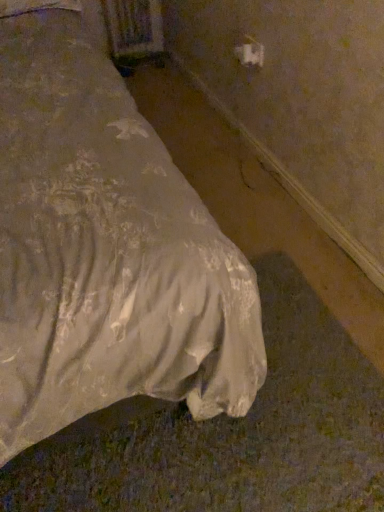
Question: Is white fabric bed at lower left wider than white plastic outlet at upper right?

Choices:
 (A) yes
 (B) no

Answer: (A)

Question: Does white fabric bed at lower left contain white plastic outlet at upper right?

Choices:
 (A) yes
 (B) no

Answer: (B)

Question: Can we say white fabric bed at lower left lies outside white plastic outlet at upper right?

Choices:
 (A) no
 (B) yes

Answer: (B)

Question: Is white fabric bed at lower left with white plastic outlet at upper right?

Choices:
 (A) no
 (B) yes

Answer: (A)

Question: From the image's perspective, is white fabric bed at lower left under white plastic outlet at upper right?

Choices:
 (A) yes
 (B) no

Answer: (A)

Question: From a real-world perspective, does white fabric bed at lower left stand above white plastic outlet at upper right?

Choices:
 (A) no
 (B) yes

Answer: (B)

Question: Is white plastic outlet at upper right next to white fabric bed at lower left and touching it?

Choices:
 (A) yes
 (B) no

Answer: (B)

Question: Considering the relative sizes of white plastic outlet at upper right and white fabric bed at lower left in the image provided, is white plastic outlet at upper right bigger than white fabric bed at lower left?

Choices:
 (A) yes
 (B) no

Answer: (B)

Question: Does white plastic outlet at upper right appear on the left side of white fabric bed at lower left?

Choices:
 (A) no
 (B) yes

Answer: (A)

Question: From a real-world perspective, is white plastic outlet at upper right positioned under white fabric bed at lower left based on gravity?

Choices:
 (A) no
 (B) yes

Answer: (B)

Question: From the image's perspective, is white plastic outlet at upper right on white fabric bed at lower left?

Choices:
 (A) yes
 (B) no

Answer: (A)

Question: From the image's perspective, is white plastic outlet at upper right under white fabric bed at lower left?

Choices:
 (A) yes
 (B) no

Answer: (B)

Question: In the image, is white fabric bed at lower left positioned in front of or behind white plastic outlet at upper right?

Choices:
 (A) behind
 (B) front

Answer: (B)